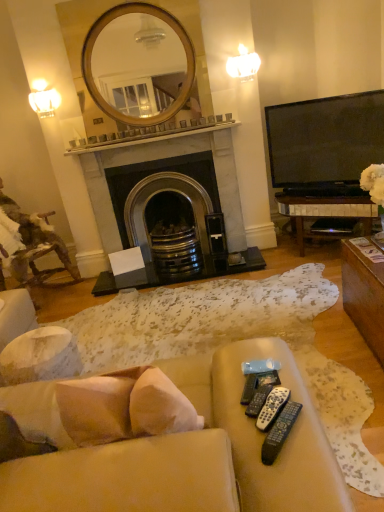
Question: From the image's perspective, is black marble fireplace at center above matte white lampshade at upper left, the 1th light fixture when ordered from bottom to top?

Choices:
 (A) yes
 (B) no

Answer: (B)

Question: Can you confirm if black marble fireplace at center is thinner than matte white lampshade at upper left, which is the second light fixture in right-to-left order?

Choices:
 (A) no
 (B) yes

Answer: (A)

Question: Does black marble fireplace at center come behind matte white lampshade at upper left, which is the second light fixture in right-to-left order?

Choices:
 (A) yes
 (B) no

Answer: (A)

Question: Does black marble fireplace at center have a greater width compared to matte white lampshade at upper left, which is the second light fixture in right-to-left order?

Choices:
 (A) yes
 (B) no

Answer: (A)

Question: From a real-world perspective, is black marble fireplace at center under matte white lampshade at upper left, the second light fixture in the top-to-bottom sequence?

Choices:
 (A) no
 (B) yes

Answer: (B)

Question: Is point (153, 271) closer or farther from the camera than point (256, 399)?

Choices:
 (A) farther
 (B) closer

Answer: (A)

Question: In terms of size, does black marble fireplace at center appear bigger or smaller than black plastic remote control at lower center, placed as the 3th remote control when sorted from front to back?

Choices:
 (A) big
 (B) small

Answer: (A)

Question: Do you think black marble fireplace at center is within black plastic remote control at lower center, placed as the 3th remote control when sorted from front to back, or outside of it?

Choices:
 (A) outside
 (B) inside

Answer: (A)

Question: From the image's perspective, is black marble fireplace at center positioned above or below black plastic remote control at lower center, the second remote control in the back-to-front sequence?

Choices:
 (A) above
 (B) below

Answer: (A)

Question: Is point (261, 415) closer or farther from the camera than point (241, 398)?

Choices:
 (A) closer
 (B) farther

Answer: (A)

Question: Relative to black plastic remote control at lower center, marked as the fourth remote control in a front-to-back arrangement, is white plastic remote controls at lower right, which is counted as the 3th remote control, starting from the back, in front or behind?

Choices:
 (A) front
 (B) behind

Answer: (A)

Question: In the image, is white plastic remote controls at lower right, which is counted as the second remote control, starting from the front, on the left side or the right side of black plastic remote control at lower center, the 1th remote control positioned from the back?

Choices:
 (A) right
 (B) left

Answer: (A)

Question: Which is correct: white plastic remote controls at lower right, which is counted as the 3th remote control, starting from the back, is inside black plastic remote control at lower center, marked as the fourth remote control in a front-to-back arrangement, or outside of it?

Choices:
 (A) inside
 (B) outside

Answer: (B)

Question: Based on their positions, is black plastic remote control at lower center, the second remote control in the back-to-front sequence, located to the left or right of black marble fireplace at center?

Choices:
 (A) left
 (B) right

Answer: (B)

Question: From the image's perspective, relative to black marble fireplace at center, is black plastic remote control at lower center, the second remote control in the back-to-front sequence, above or below?

Choices:
 (A) above
 (B) below

Answer: (B)